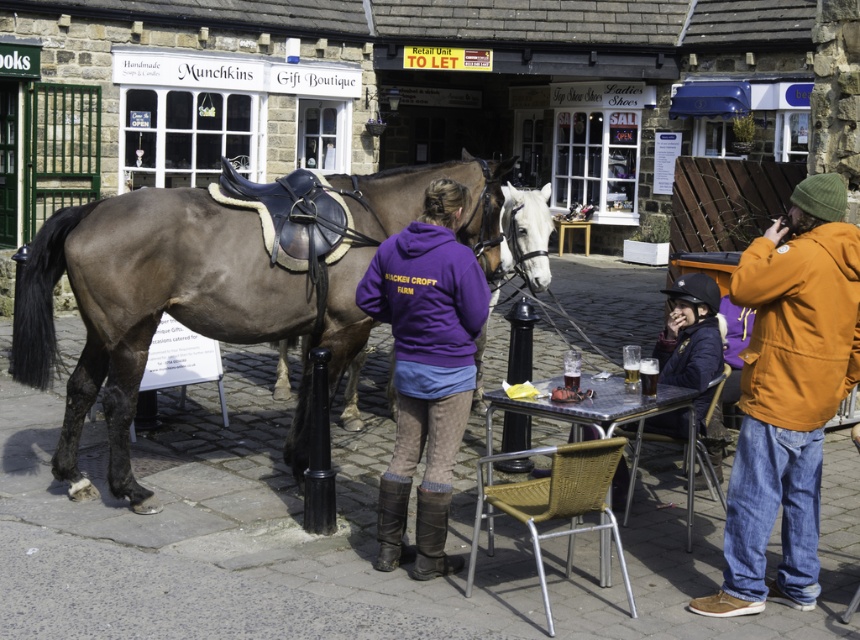
Who is shorter, orange fleece jacket at right or metallic silver table at lower center?

With less height is metallic silver table at lower center.

Can you confirm if orange fleece jacket at right is positioned to the right of metallic silver table at lower center?

Indeed, orange fleece jacket at right is positioned on the right side of metallic silver table at lower center.

Who is more forward, (840,227) or (642,394)?

Point (840,227) is more forward.

Identify the location of orange fleece jacket at right. The height and width of the screenshot is (640, 860). (788, 394).

Which of these two, purple fleece at center or metallic silver table at lower center, stands shorter?

Standing shorter between the two is metallic silver table at lower center.

Does point (452, 449) lie behind point (618, 392)?

No, it is not.

Who is more distant from viewer, [394,538] or [556,404]?

The point [394,538] is behind.

Where is `purple fleece at center`? purple fleece at center is located at coordinates (427, 369).

Does brown leather saddle at center appear on the right side of purple fleece at center?

No, brown leather saddle at center is not to the right of purple fleece at center.

Which is behind, point (177, 243) or point (395, 364)?

Positioned behind is point (177, 243).

This screenshot has width=860, height=640. I want to click on brown leather saddle at center, so click(x=163, y=305).